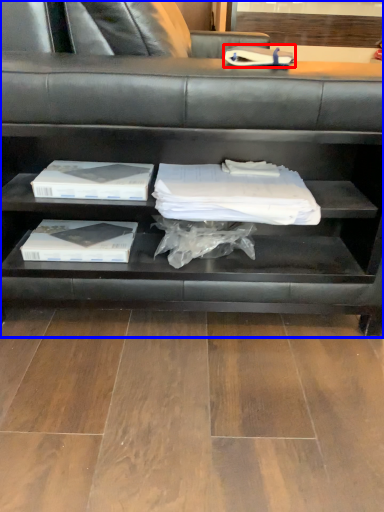
Question: Among these objects, which one is farthest to the camera, book (highlighted by a red box) or shelf (highlighted by a blue box)?

Choices:
 (A) book
 (B) shelf

Answer: (A)